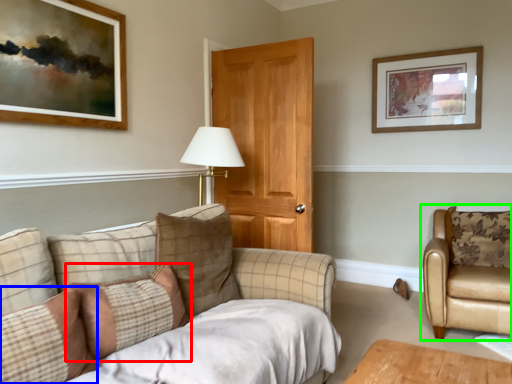
Question: Estimate the real-world distances between objects in this image. Which object is farther from pillow (highlighted by a red box), pillow (highlighted by a blue box) or chair (highlighted by a green box)?

Choices:
 (A) pillow
 (B) chair

Answer: (B)